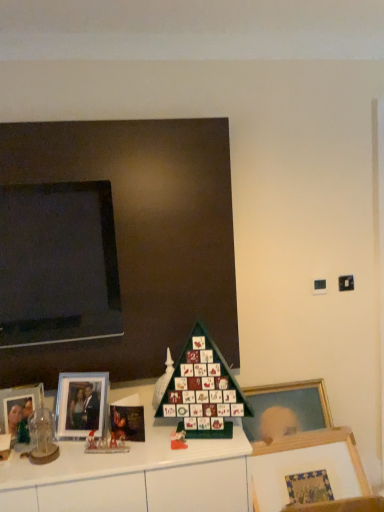
The width and height of the screenshot is (384, 512). What are the coordinates of `free location in front of green matte advent calendar at center` in the screenshot? It's located at (198, 449).